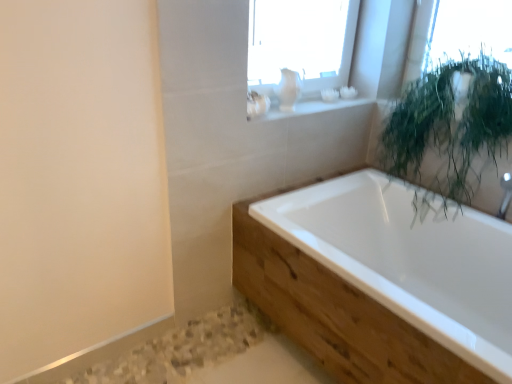
The image size is (512, 384). What do you see at coordinates (295, 107) in the screenshot?
I see `white ceramic vase at upper center` at bounding box center [295, 107].

What is the approximate width of white glossy bathtub at center?

It is 35.29 inches.

The image size is (512, 384). Identify the location of green leafy plant at upper right. (450, 128).

Is white ceramic vase at upper center oriented towards green leafy plant at upper right?

No, white ceramic vase at upper center does not turn towards green leafy plant at upper right.

From the image's perspective, which one is positioned higher, white ceramic vase at upper center or green leafy plant at upper right?

From the image's view, white ceramic vase at upper center is above.

From the picture: Can you confirm if white ceramic vase at upper center is bigger than green leafy plant at upper right?

Incorrect, white ceramic vase at upper center is not larger than green leafy plant at upper right.

Which object is further away from the camera taking this photo, white ceramic vase at upper center or green leafy plant at upper right?

white ceramic vase at upper center is more distant.

In terms of width, does green leafy plant at upper right look wider or thinner when compared to white ceramic vase at upper center?

Clearly, green leafy plant at upper right has more width compared to white ceramic vase at upper center.

Are green leafy plant at upper right and white ceramic vase at upper center far apart?

No, there isn't a large distance between green leafy plant at upper right and white ceramic vase at upper center.

Is green leafy plant at upper right oriented towards white ceramic vase at upper center?

No, green leafy plant at upper right does not turn towards white ceramic vase at upper center.

Does green leafy plant at upper right contain white ceramic vase at upper center?

That's incorrect, white ceramic vase at upper center is not inside green leafy plant at upper right.

From the image's perspective, is white glossy bathtub at center above or below green leafy plant at upper right?

Based on their image positions, white glossy bathtub at center is located beneath green leafy plant at upper right.

Based on the photo, does white glossy bathtub at center touch green leafy plant at upper right?

No, white glossy bathtub at center is not with green leafy plant at upper right.

Considering the sizes of objects white glossy bathtub at center and green leafy plant at upper right in the image provided, who is thinner, white glossy bathtub at center or green leafy plant at upper right?

With smaller width is green leafy plant at upper right.

From a real-world perspective, is white glossy bathtub at center positioned above or below green leafy plant at upper right?

white glossy bathtub at center is below green leafy plant at upper right.

Considering the sizes of objects white ceramic vase at upper center and white glossy bathtub at center in the image provided, who is thinner, white ceramic vase at upper center or white glossy bathtub at center?

With smaller width is white ceramic vase at upper center.

From a real-world perspective, which object stands above the other?

white ceramic vase at upper center.

Is point (316, 111) positioned after point (413, 274)?

That is True.

Is the position of white ceramic vase at upper center less distant than that of white glossy bathtub at center?

No, it is not.

Considering the points (401, 115) and (285, 220), which point is in front, point (401, 115) or point (285, 220)?

Point (285, 220)

Measure the distance between green leafy plant at upper right and white glossy bathtub at center.

A distance of 16.93 inches exists between green leafy plant at upper right and white glossy bathtub at center.

Which of these two, green leafy plant at upper right or white glossy bathtub at center, is thinner?

Thinner between the two is green leafy plant at upper right.

Is white glossy bathtub at center surrounded by green leafy plant at upper right?

No, white glossy bathtub at center is not a part of green leafy plant at upper right.

From a real-world perspective, which is physically below, white glossy bathtub at center or white ceramic vase at upper center?

white glossy bathtub at center is physically lower.

Considering the sizes of white glossy bathtub at center and white ceramic vase at upper center in the image, is white glossy bathtub at center taller or shorter than white ceramic vase at upper center?

Clearly, white glossy bathtub at center is taller compared to white ceramic vase at upper center.

Is white glossy bathtub at center far away from white ceramic vase at upper center?

Actually, white glossy bathtub at center and white ceramic vase at upper center are a little close together.

Measure the distance from white glossy bathtub at center to white ceramic vase at upper center.

white glossy bathtub at center is 69.47 centimeters away from white ceramic vase at upper center.

Locate an element on the screen. vegetation that appears in front of the white ceramic vase at upper center is located at coordinates (450, 128).

Image resolution: width=512 pixels, height=384 pixels. Find the location of `vegetation that is under the white ceramic vase at upper center (from a real-world perspective)`. vegetation that is under the white ceramic vase at upper center (from a real-world perspective) is located at coordinates (450, 128).

Consider the image. From the image, which object appears to be nearer to white ceramic vase at upper center, white glossy bathtub at center or green leafy plant at upper right?

Among the two, green leafy plant at upper right is located nearer to white ceramic vase at upper center.

Estimate the real-world distances between objects in this image. Which object is further from white ceramic vase at upper center, green leafy plant at upper right or white glossy bathtub at center?

The object further to white ceramic vase at upper center is white glossy bathtub at center.

Looking at this image, looking at the image, which one is located further to green leafy plant at upper right, white ceramic vase at upper center or white glossy bathtub at center?

The object further to green leafy plant at upper right is white ceramic vase at upper center.

Based on their spatial positions, is white ceramic vase at upper center or green leafy plant at upper right further from white glossy bathtub at center?

white ceramic vase at upper center is further to white glossy bathtub at center.

Estimate the real-world distances between objects in this image. Which object is closer to white glossy bathtub at center, green leafy plant at upper right or white ceramic vase at upper center?

green leafy plant at upper right lies closer to white glossy bathtub at center than the other object.

Looking at the image, which one is located closer to green leafy plant at upper right, white glossy bathtub at center or white ceramic vase at upper center?

white glossy bathtub at center lies closer to green leafy plant at upper right than the other object.

Locate an element on the screen. vegetation between white ceramic vase at upper center and white glossy bathtub at center from top to bottom is located at coordinates (450, 128).